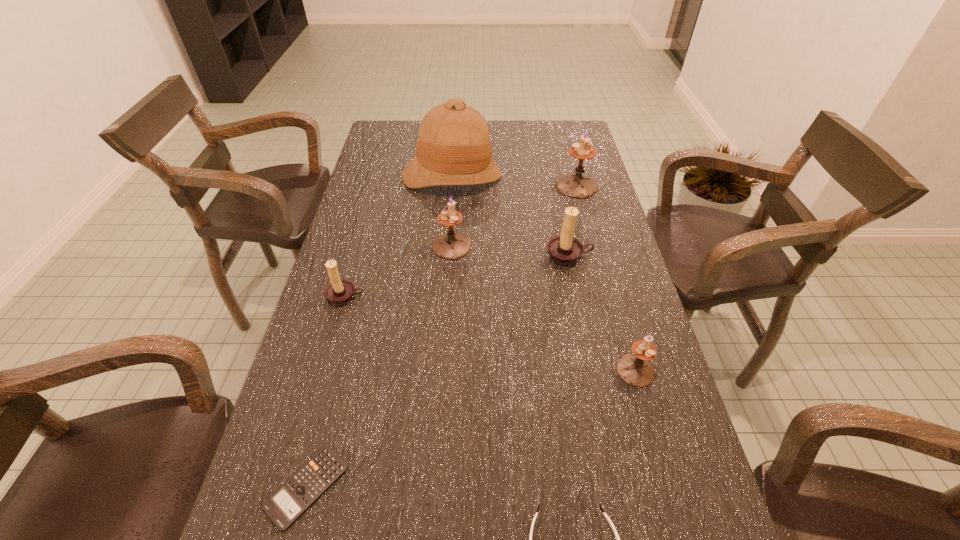
Choose which purple candle holder is the nearest neighbor to the second nearest purple candle holder. Please provide its 2D coordinates. Your answer should be formatted as a tuple, i.e. [(x, y)], where the tuple contains the x and y coordinates of a point satisfying the conditions above.

[(575, 185)]

This screenshot has width=960, height=540. Identify the location of free location that satisfies the following two spatial constraints: 1. on the front-facing side of the hat; 2. on the right side of the nearest candle holder. (437, 370).

I want to click on vacant area in the image that satisfies the following two spatial constraints: 1. on the wick of the smaller brown candle holder; 2. on the left side of the calculator, so click(292, 487).

You are a GUI agent. You are given a task and a screenshot of the screen. Output one action in this format:
    pyautogui.click(x=<x>, y=<y>)
    Task: Click on the blank area in the image that satisfies the following two spatial constraints: 1. on the wick of the nearer brown candle holder; 2. on the right side of the sixth farthest object
    
    Given the screenshot: What is the action you would take?
    pyautogui.click(x=324, y=370)